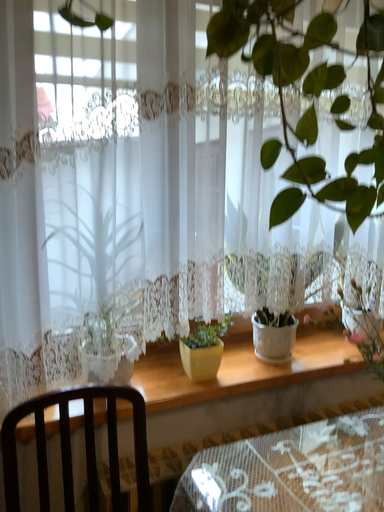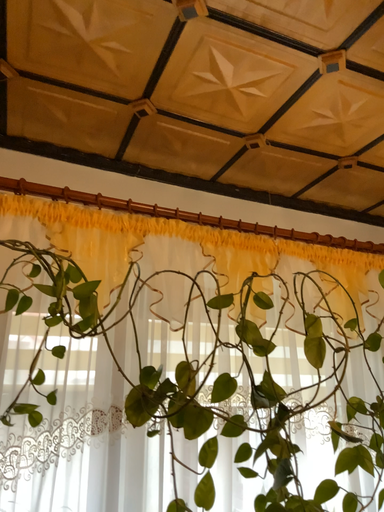
Question: Which way did the camera rotate in the video?

Choices:
 (A) rotated upward
 (B) rotated downward

Answer: (A)